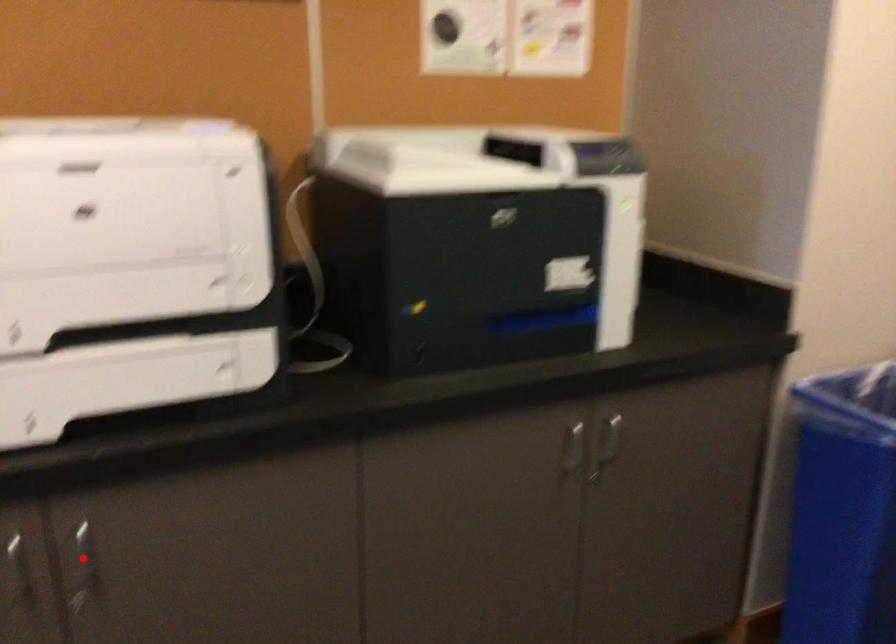
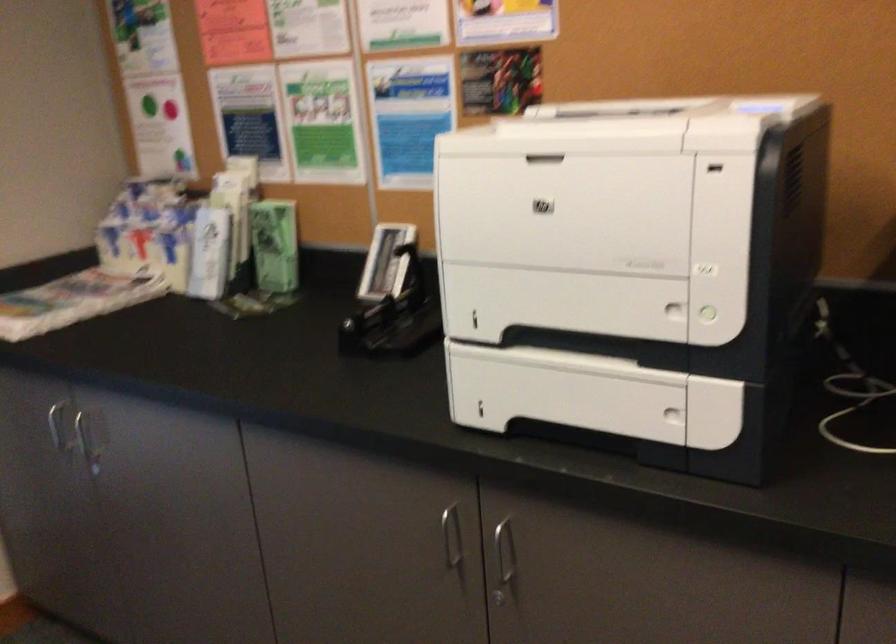
Locate, in the second image, the point that corresponds to the highlighted location in the first image.

(504, 559)